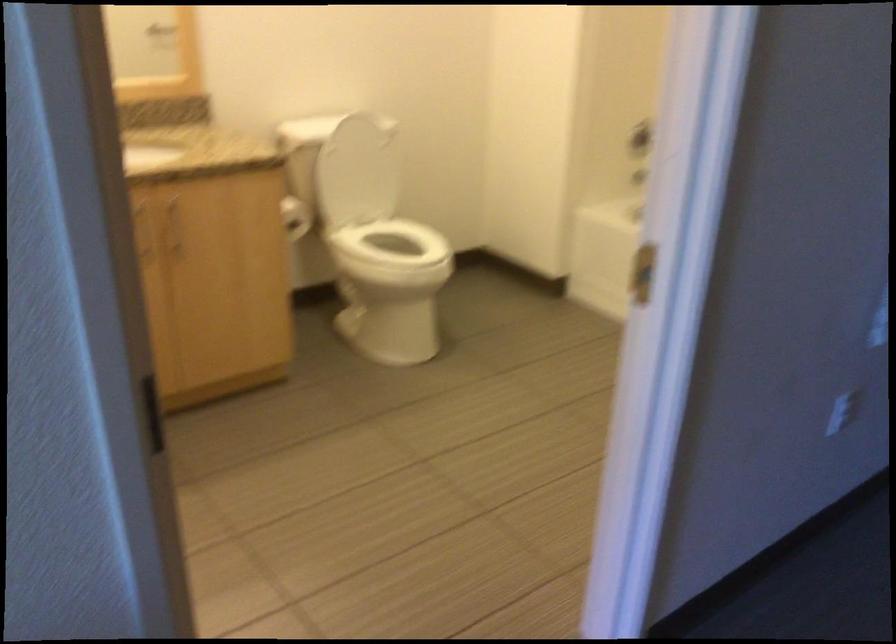
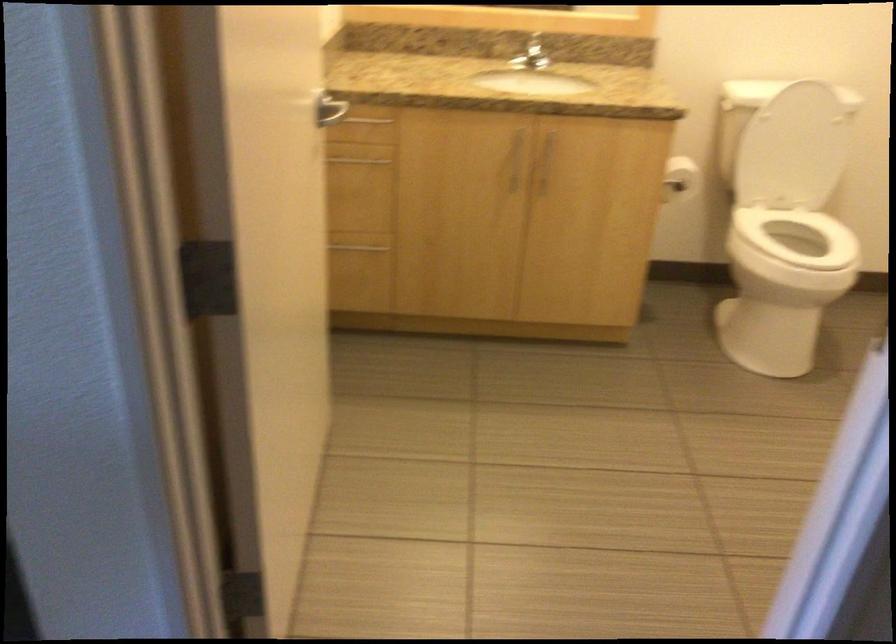
Where in the second image is the point corresponding to the point at 362,166 from the first image?

(793, 149)